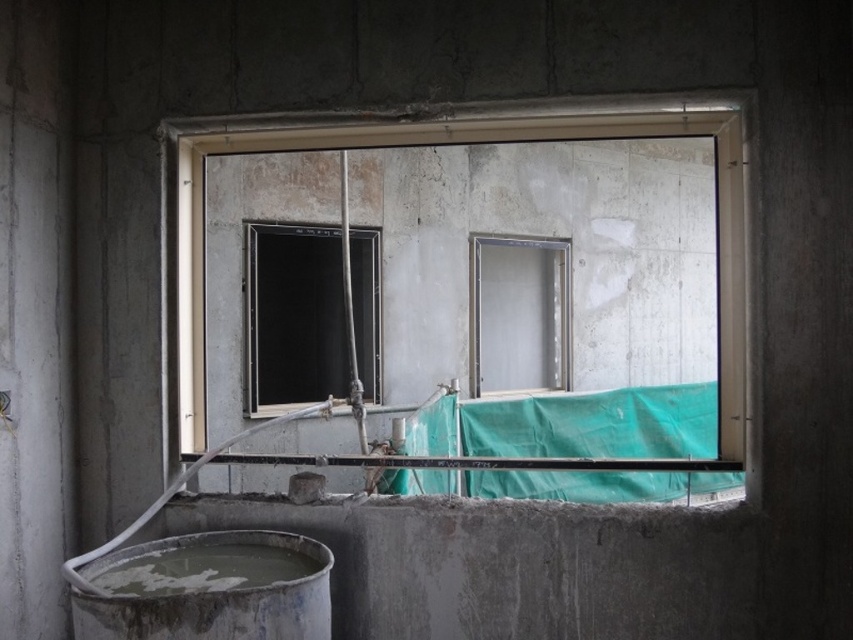
You are standing in the unfinished interior space. There is a point marked at coordinates (x=473, y=301). Based on the scene description, where is this point located?

The point is located on the smooth concrete window at center, as described in the objects description.

You are an inspector checking the construction site. You notice the transparent glass window at center and the clear glass door at center. Which one has a larger area?

The clear glass door at center has a larger area than the transparent glass window at center since the window is smaller in size according to the description.